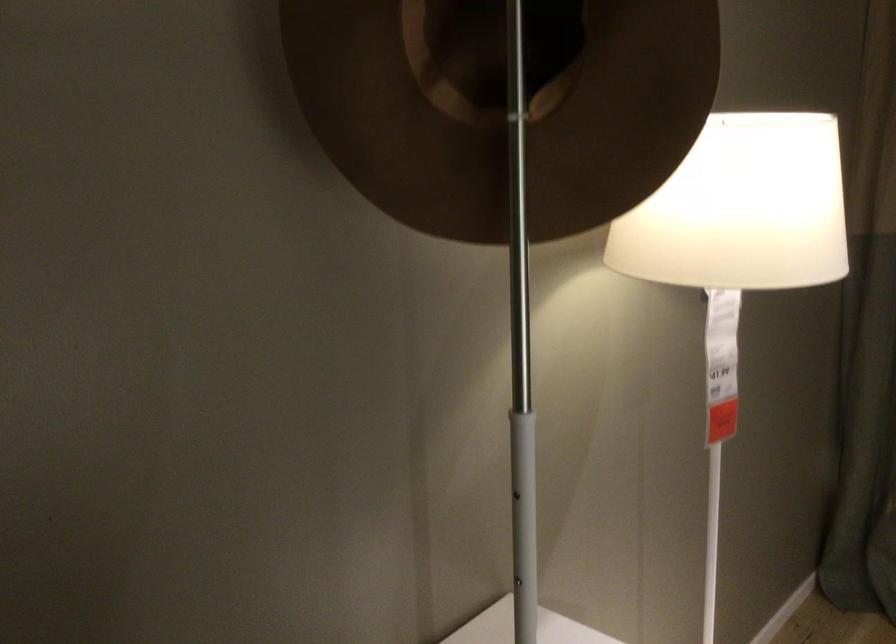
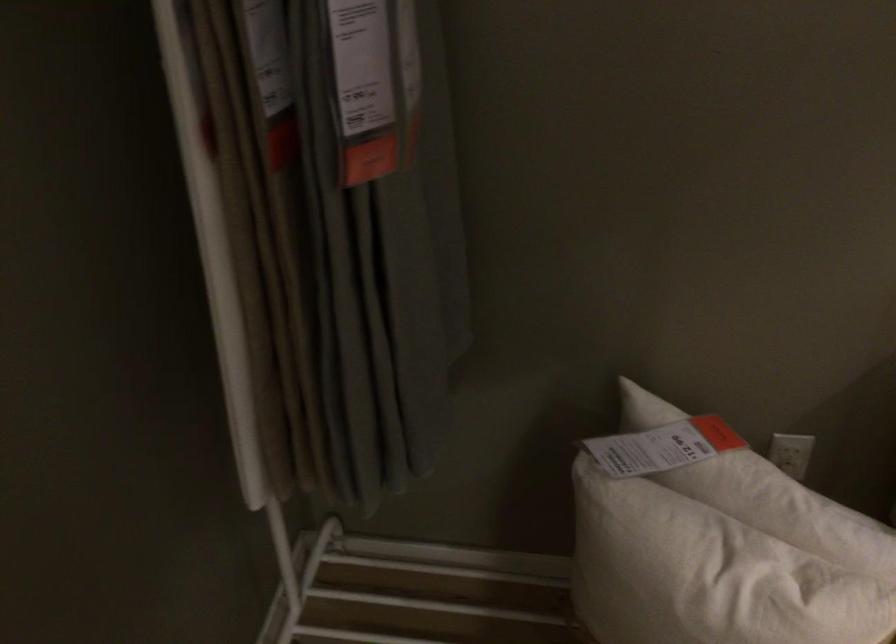
How did the camera likely rotate?

The rotation direction of the camera is left-down.